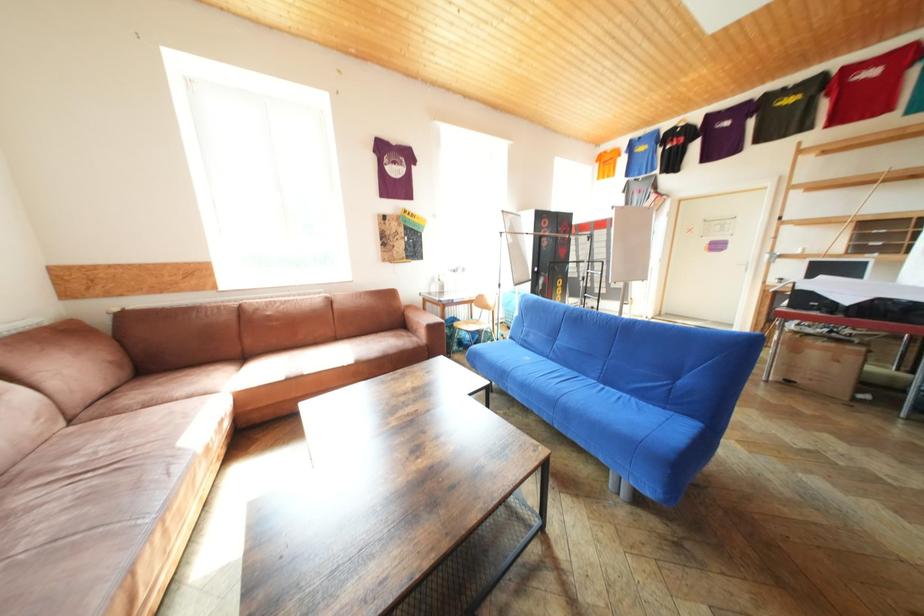
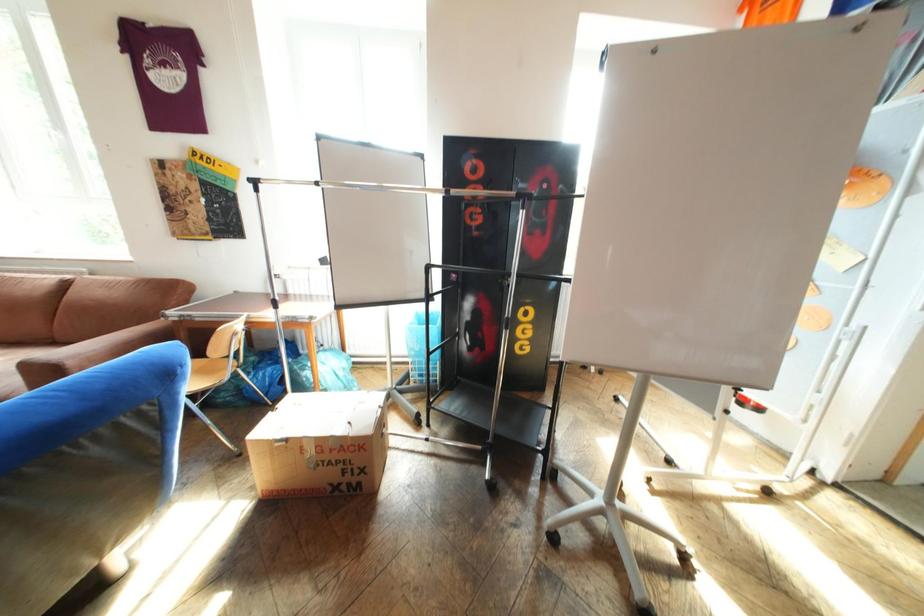
In the scene shown: In a continuous first-person perspective shot, in which direction is the camera moving?

The cameraman walked toward right, forward.